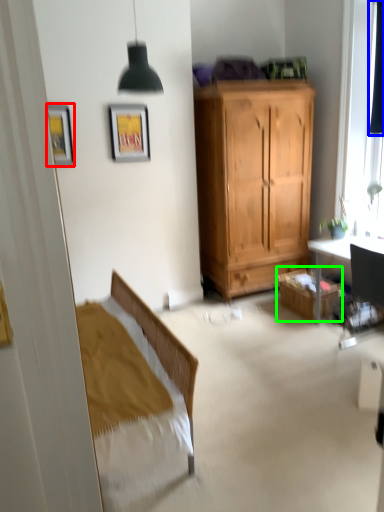
Question: Which object is positioned farthest from picture frame (highlighted by a red box)? Select from curtain (highlighted by a blue box) and cabinetry (highlighted by a green box).

Choices:
 (A) curtain
 (B) cabinetry

Answer: (A)